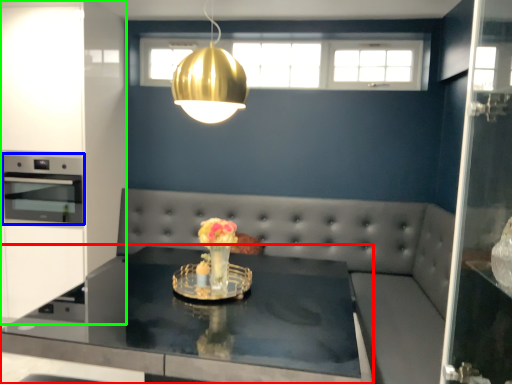
Question: Which object is positioned closest to table (highlighted by a red box)? Select from appliance (highlighted by a blue box) and cabinetry (highlighted by a green box).

Choices:
 (A) appliance
 (B) cabinetry

Answer: (A)